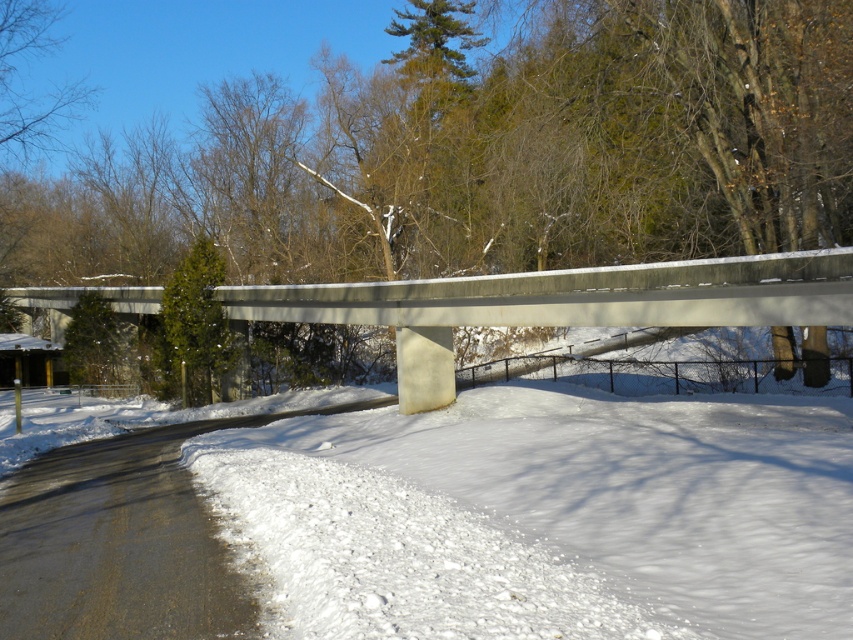
You are an engineer assessing the structural integrity of the bridge. You notice the white powdery snow at lower center and the concrete at upper center. Which of these two areas is more likely to support heavy machinery during winter operations?

The concrete at upper center is more likely to support heavy machinery during winter operations because it is larger than the white powdery snow at lower center.

You are standing on the bridge and looking down. You see the white powdery snow at lower center and the concrete at upper center. Which one is closer to your eyes?

The white powdery snow at lower center is closer to your eyes because it is in front of the concrete at upper center.